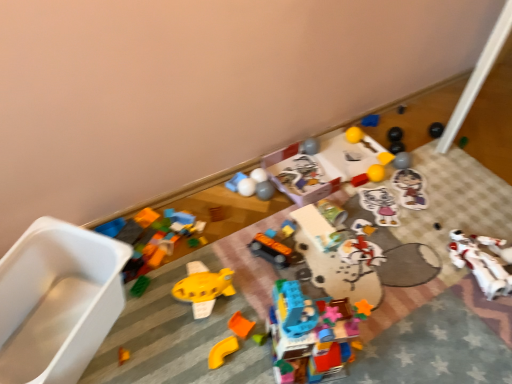
At what (x,y) coordinates should I click in order to perform the action: click on free space in front of matte black car at center, the eighth toy positioned from the left. Please return your answer as a coordinate pair (x, y). Image resolution: width=512 pixels, height=384 pixels. Looking at the image, I should click on (254, 294).